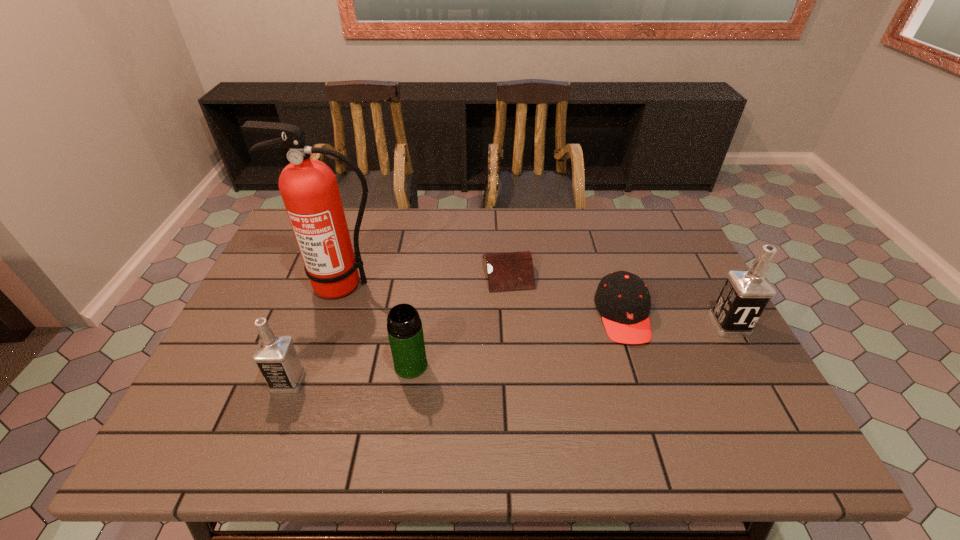
The height and width of the screenshot is (540, 960). I want to click on vacant area that satisfies the following two spatial constraints: 1. on the handle side of the tallest object; 2. on the front label of the left vodka, so click(x=310, y=381).

You are a GUI agent. You are given a task and a screenshot of the screen. Output one action in this format:
    pyautogui.click(x=<x>, y=<y>)
    Task: Click on the vacant space that satisfies the following two spatial constraints: 1. from the spout of the third object from left to right; 2. on the front label of the shorter vodka
    The width and height of the screenshot is (960, 540).
    Given the screenshot: What is the action you would take?
    pyautogui.click(x=409, y=381)

I want to click on vacant space that satisfies the following two spatial constraints: 1. on the front-facing side of the fifth tallest object; 2. on the front label of the left vodka, so click(x=644, y=381).